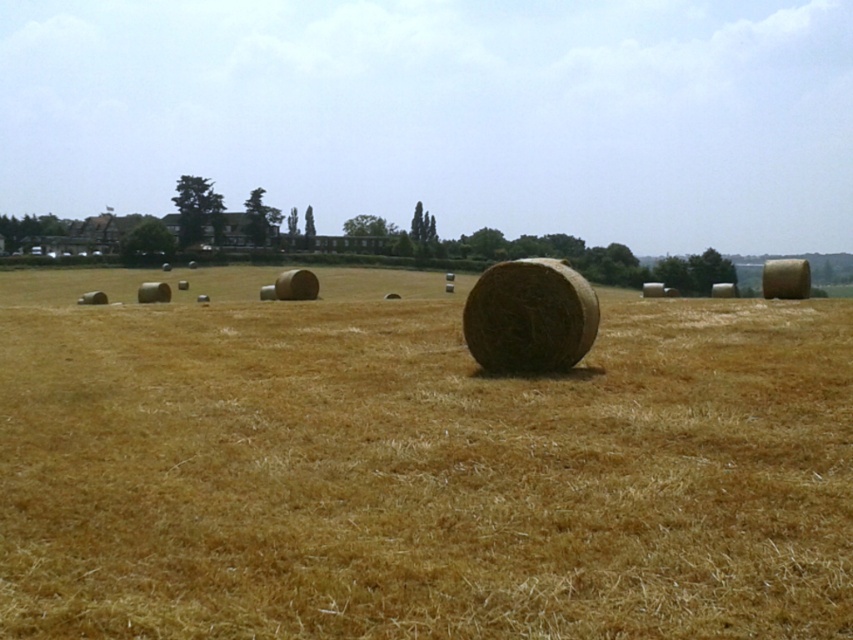
Does dry straw at center appear over natural straw bale at center?

Indeed, dry straw at center is positioned over natural straw bale at center.

Can you confirm if dry straw at center is smaller than natural straw bale at center?

Actually, dry straw at center might be larger than natural straw bale at center.

Who is more distant from viewer, (368, 396) or (521, 266)?

Point (521, 266)

At what (x,y) coordinates should I click in order to perform the action: click on dry straw at center. Please return your answer as a coordinate pair (x, y). Image resolution: width=853 pixels, height=640 pixels. Looking at the image, I should click on (415, 467).